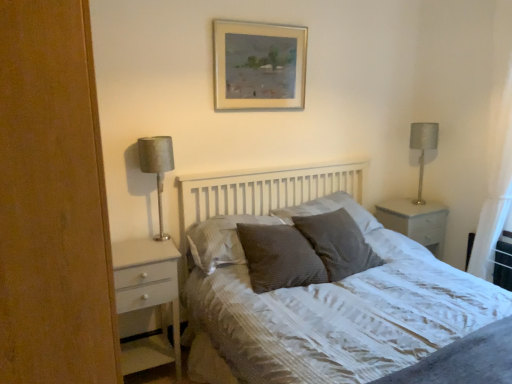
Question: From the image's perspective, is textured gray pillow at center, which is the 4th pillow from left to right, positioned above or below silver metallic lampshade at right?

Choices:
 (A) above
 (B) below

Answer: (B)

Question: Considering the positions of textured gray pillow at center, the 1th pillow in the right-to-left sequence, and silver metallic lampshade at right in the image, is textured gray pillow at center, the 1th pillow in the right-to-left sequence, wider or thinner than silver metallic lampshade at right?

Choices:
 (A) thin
 (B) wide

Answer: (B)

Question: Which is farther from the satin silver lamp at left?

Choices:
 (A) textured gray pillow at center, positioned as the 3th pillow in left-to-right order
 (B) silver metallic lampshade at right
 (C) dark grey textured pillow at center, positioned as the 3th pillow in right-to-left order
 (D) white textured bed at center
 (E) gold-framed painting at upper center

Answer: (B)

Question: Estimate the real-world distances between objects in this image. Which object is farther from the textured gray pillow at center, acting as the second pillow starting from the right?

Choices:
 (A) silver metallic lampshade at right
 (B) gold-framed painting at upper center
 (C) satin brown pillow at center, the fourth pillow when ordered from right to left
 (D) white sheer curtain at right
 (E) satin silver lamp at left

Answer: (E)